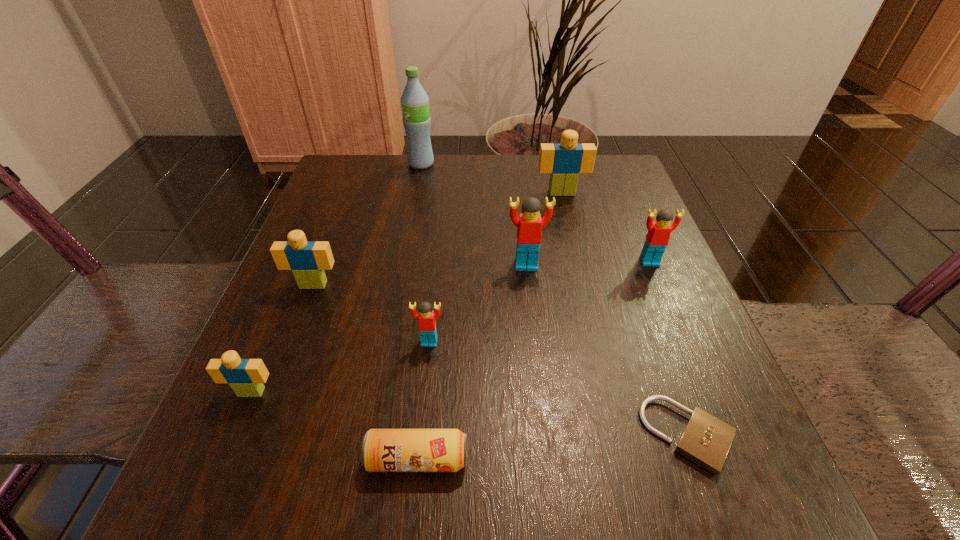
Locate an element on the screen. padlock present at the right edge is located at coordinates (x=706, y=440).

Where is `object that is positioned at the far right corner`? This screenshot has height=540, width=960. object that is positioned at the far right corner is located at coordinates (564, 161).

Where is `object present at the near right corner`? The height and width of the screenshot is (540, 960). object present at the near right corner is located at coordinates (706, 440).

I want to click on vacant space at the far edge of the desktop, so click(408, 168).

Image resolution: width=960 pixels, height=540 pixels. In the image, there is a desktop. Identify the location of free space at the near edge. (527, 458).

In the image, there is a desktop. Where is `vacant space at the left edge`? The height and width of the screenshot is (540, 960). vacant space at the left edge is located at coordinates (312, 316).

Where is `vacant space at the right edge of the desktop`? The width and height of the screenshot is (960, 540). vacant space at the right edge of the desktop is located at coordinates (630, 383).

I want to click on vacant position at the far left corner of the desktop, so [331, 201].

Identify the location of free space at the near left corner of the desktop. Image resolution: width=960 pixels, height=540 pixels. [x=302, y=517].

Where is `free space at the far right corner`? The height and width of the screenshot is (540, 960). free space at the far right corner is located at coordinates (623, 158).